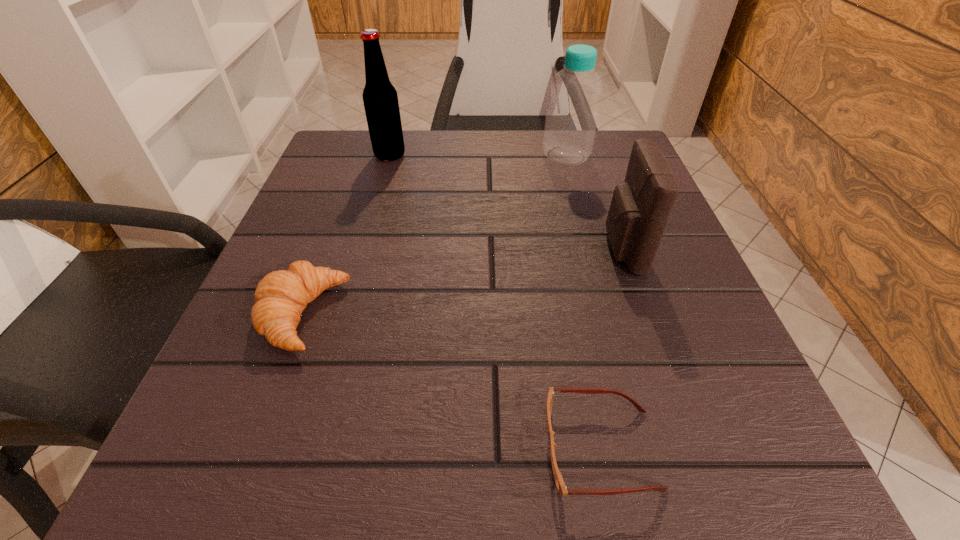
This screenshot has width=960, height=540. I want to click on vacant area that lies between the shortest object and the bottle, so click(584, 302).

This screenshot has width=960, height=540. In order to click on free space between the crescent roll and the pouch in this screenshot , I will do `click(462, 282)`.

Identify the location of empty space between the beer bottle and the third tallest object. The image size is (960, 540). (506, 202).

This screenshot has width=960, height=540. What are the coordinates of `the fourth closest object to the beer bottle` in the screenshot? It's located at (560, 484).

The width and height of the screenshot is (960, 540). Identify the location of object that stands as the second closest to the bottle. (380, 98).

This screenshot has height=540, width=960. Identify the location of vacant space that satisfies the following two spatial constraints: 1. on the front side of the bottle; 2. on the left side of the beer bottle. (390, 156).